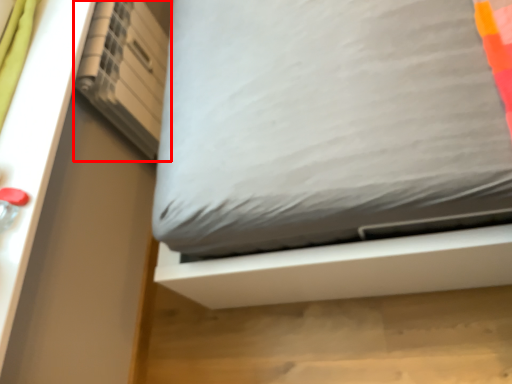
Question: Considering the relative positions of shelf (annotated by the red box) and bed in the image provided, where is shelf (annotated by the red box) located with respect to the staircase?

Choices:
 (A) right
 (B) left

Answer: (B)